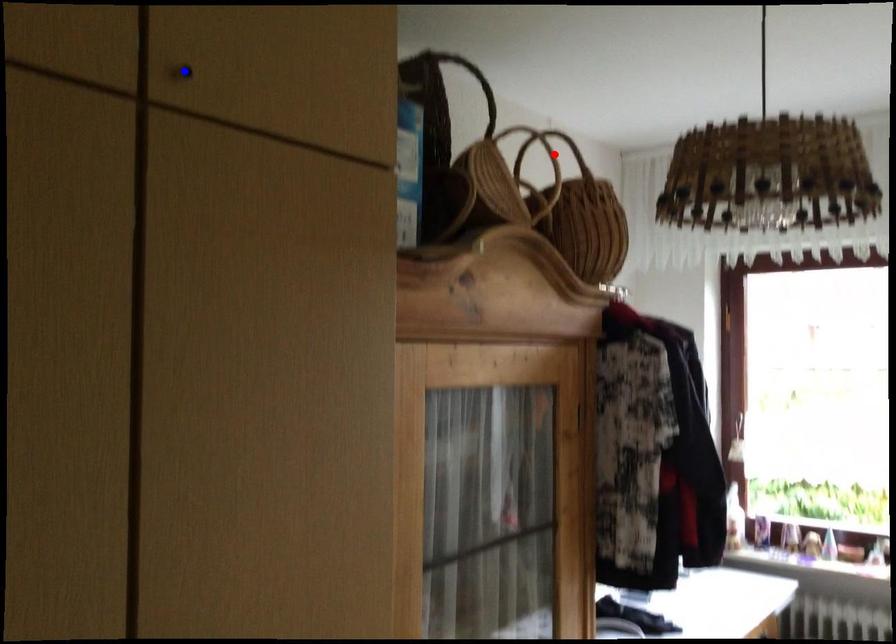
Question: Two points are marked on the image. Which point is closer to the camera?

Choices:
 (A) Blue point is closer.
 (B) Red point is closer.

Answer: (A)